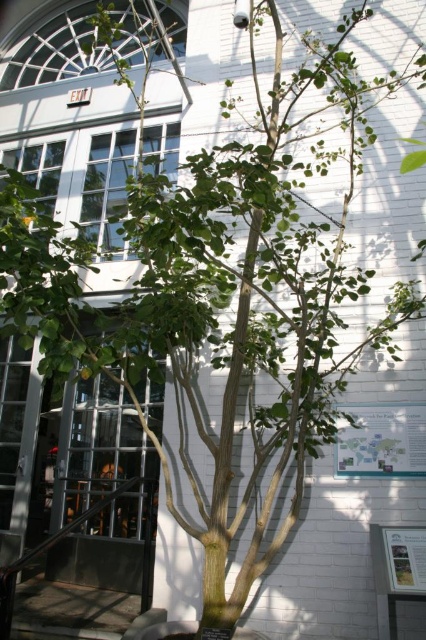
Between point (368, 410) and point (149, 602), which one is positioned in front?

Point (149, 602)

Looking at this image, does green paper map at center lie behind metallic glass door at center?

Yes.

Is point (365, 461) farther from camera compared to point (149, 481)?

No, it is in front of (149, 481).

You are a GUI agent. You are given a task and a screenshot of the screen. Output one action in this format:
    pyautogui.click(x=<x>, y=<y>)
    Task: Click on the green paper map at center
    The width and height of the screenshot is (426, 640).
    Given the screenshot: What is the action you would take?
    pyautogui.click(x=382, y=440)

Who is shorter, green paper map at center or white paperboard at lower right?

→ white paperboard at lower right is shorter.

Does green paper map at center come in front of white paperboard at lower right?

No, green paper map at center is behind white paperboard at lower right.

Describe the element at coordinates (382, 440) in the screenshot. The height and width of the screenshot is (640, 426). I see `green paper map at center` at that location.

Identify the location of green paper map at center. Image resolution: width=426 pixels, height=640 pixels. [x=382, y=440].

Is metallic glass door at center to the left of white paperboard at lower right from the viewer's perspective?

Yes, metallic glass door at center is to the left of white paperboard at lower right.

Which of these two, metallic glass door at center or white paperboard at lower right, stands taller?

metallic glass door at center

Who is more distant from viewer, (154, 516) or (386, 545)?

Point (154, 516)

Where is `metallic glass door at center`? This screenshot has width=426, height=640. metallic glass door at center is located at coordinates (x=74, y=531).